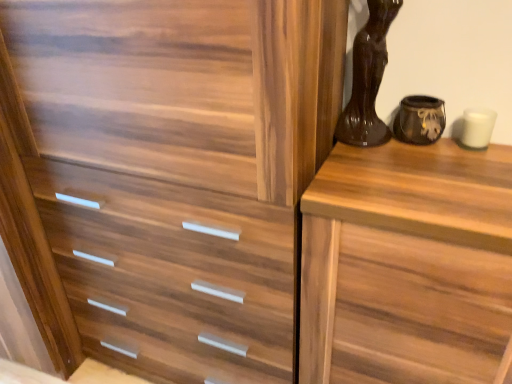
Where is `vacant area that is in front of matte black vase at upper right, arranged as the 2th vase when viewed from the left`? vacant area that is in front of matte black vase at upper right, arranged as the 2th vase when viewed from the left is located at coordinates pos(442,176).